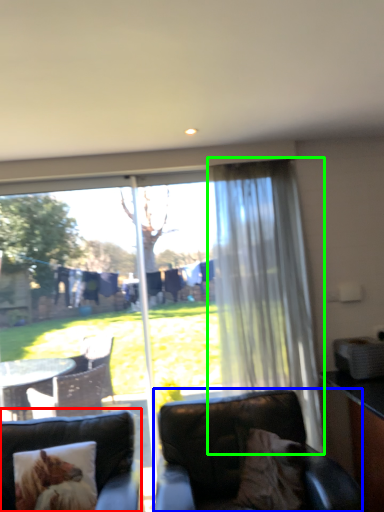
Question: Estimate the real-world distances between objects in this image. Which object is closer to studio couch (highlighted by a red box), chair (highlighted by a blue box) or curtain (highlighted by a green box)?

Choices:
 (A) chair
 (B) curtain

Answer: (A)